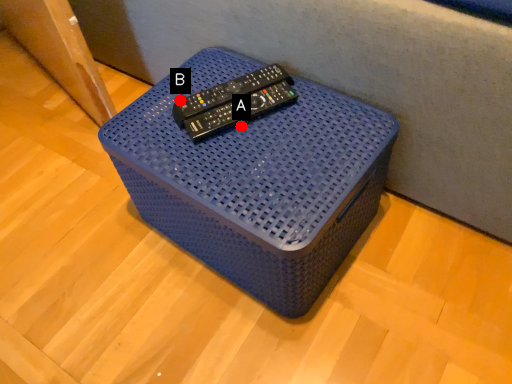
Question: Two points are circled on the image, labeled by A and B beside each circle. Which point is closer to the camera?

Choices:
 (A) A is closer
 (B) B is closer

Answer: (A)